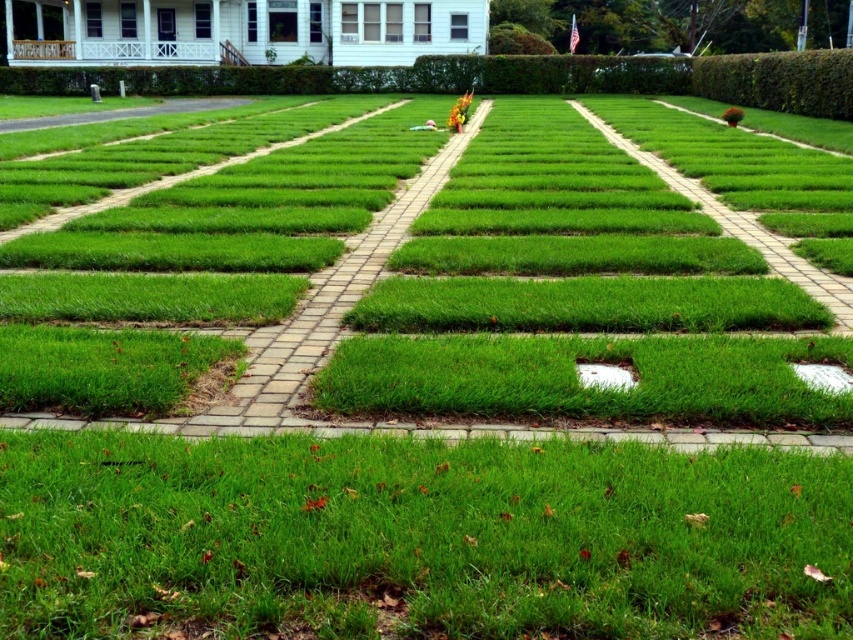
Who is positioned more to the left, white painted wood porch at upper left or white smooth patch at center?

white painted wood porch at upper left is more to the left.

Is point (85, 51) positioned before point (624, 385)?

No, it is not.

Does point (155, 51) lie behind point (627, 371)?

Yes, it is.

You are a GUI agent. You are given a task and a screenshot of the screen. Output one action in this format:
    pyautogui.click(x=<x>, y=<y>)
    Task: Click on the white painted wood porch at upper left
    Image resolution: width=853 pixels, height=640 pixels.
    Given the screenshot: What is the action you would take?
    pyautogui.click(x=112, y=51)

Between green leafy hedge at upper right and white painted wood porch at upper left, which one appears on the right side from the viewer's perspective?

green leafy hedge at upper right

Is green leafy hedge at upper right to the right of white painted wood porch at upper left from the viewer's perspective?

Yes, green leafy hedge at upper right is to the right of white painted wood porch at upper left.

This screenshot has width=853, height=640. Identify the location of green leafy hedge at upper right. (779, 81).

Is white painted wood porch at upper left smaller than white matte patch at lower right?

Actually, white painted wood porch at upper left might be larger than white matte patch at lower right.

Between point (33, 42) and point (846, 371), which one is positioned behind?

Point (33, 42)

Is point (100, 52) farther from viewer compared to point (822, 376)?

That is True.

This screenshot has width=853, height=640. I want to click on white painted wood porch at upper left, so click(112, 51).